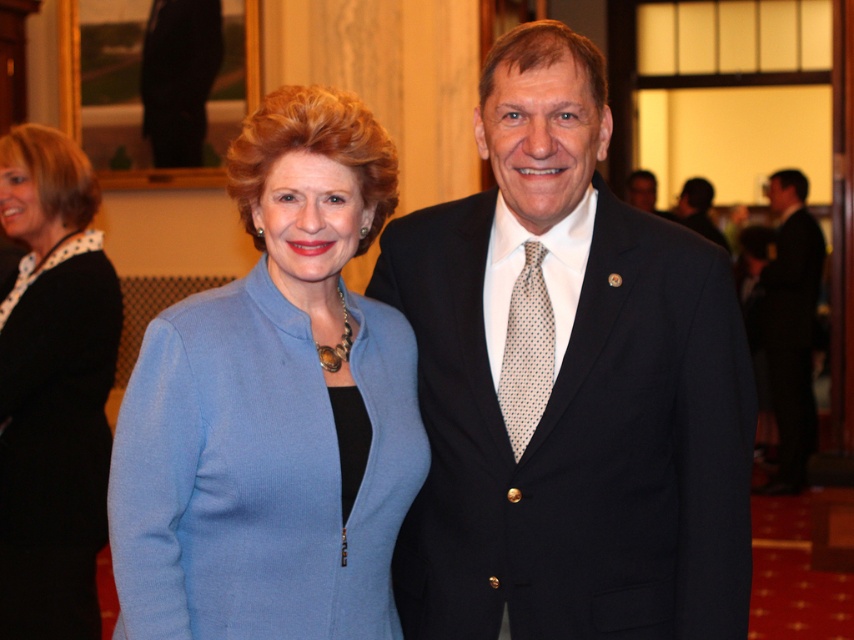
Question: Among these points, which one is nearest to the camera?

Choices:
 (A) (355, 580)
 (B) (683, 193)
 (C) (545, 376)

Answer: (A)

Question: Observing the image, what is the correct spatial positioning of black suit at center in reference to dark suit at center?

Choices:
 (A) above
 (B) below

Answer: (B)

Question: Can you confirm if black suit at center is positioned below matte black blazer at center?

Choices:
 (A) yes
 (B) no

Answer: (B)

Question: Among these objects, which one is nearest to the camera?

Choices:
 (A) blue woolen jacket at center
 (B) black suit at right
 (C) matte black blazer at center

Answer: (A)

Question: Which point is closer to the camera taking this photo?

Choices:
 (A) (507, 385)
 (B) (693, 220)

Answer: (A)

Question: Does blue woolen jacket at center appear on the right side of dark suit at center?

Choices:
 (A) yes
 (B) no

Answer: (B)